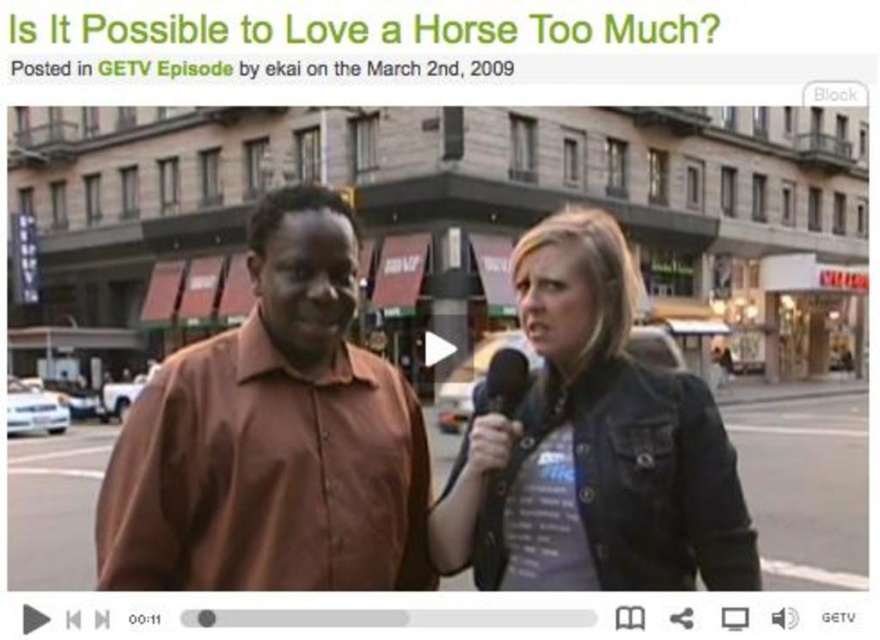
In order to click on brown shirt at center in this screenshot , I will do `click(273, 436)`.

Measure the distance between point [266,493] and camera.

Point [266,493] and camera are 5.82 feet apart from each other.

Which is in front, point (170, 461) or point (519, 509)?

Point (170, 461) is in front.

The height and width of the screenshot is (640, 880). What are the coordinates of `brown shirt at center` in the screenshot? It's located at (273, 436).

Between denim jacket at center and black matte microphone at center, which one has more height?

With more height is black matte microphone at center.

Who is positioned more to the right, denim jacket at center or black matte microphone at center?

From the viewer's perspective, black matte microphone at center appears more on the right side.

Is point (576, 252) farther from viewer compared to point (514, 376)?

No, it is in front of (514, 376).

Find the location of `denim jacket at center`. denim jacket at center is located at coordinates (594, 445).

Describe the element at coordinates (273, 436) in the screenshot. This screenshot has width=880, height=640. I see `brown shirt at center` at that location.

Between point (280, 502) and point (504, 372), which one is positioned in front?

Point (280, 502) is more forward.

Identify the location of brown shirt at center. The image size is (880, 640). (273, 436).